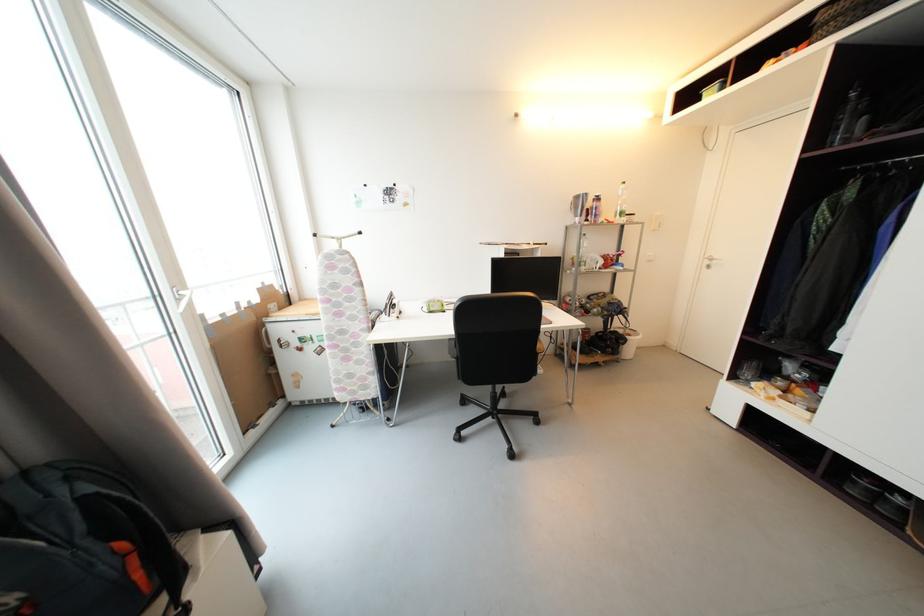
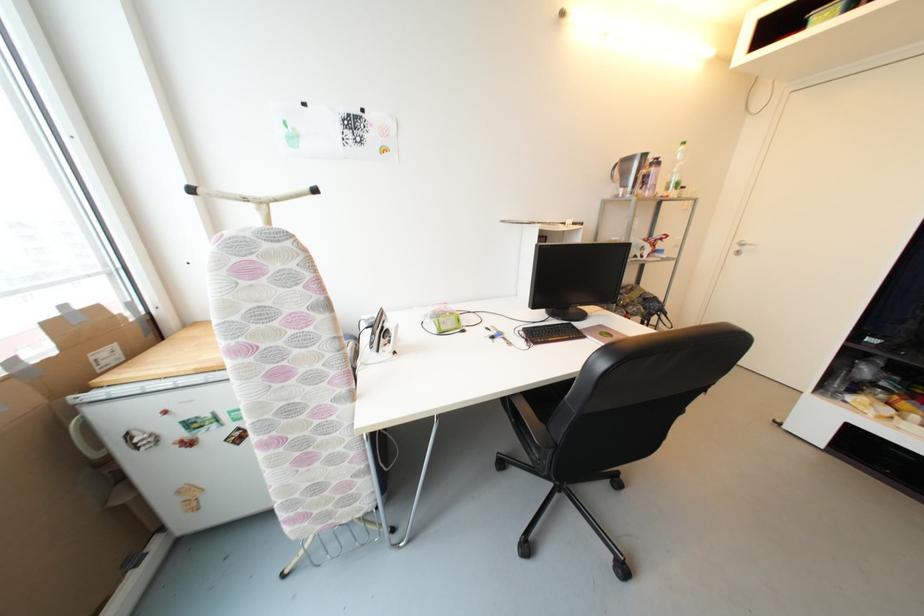
Question: The images are taken continuously from a first-person perspective. In which direction is your viewpoint rotating?

Choices:
 (A) Left
 (B) Right
 (C) Up
 (D) Down

Answer: (B)